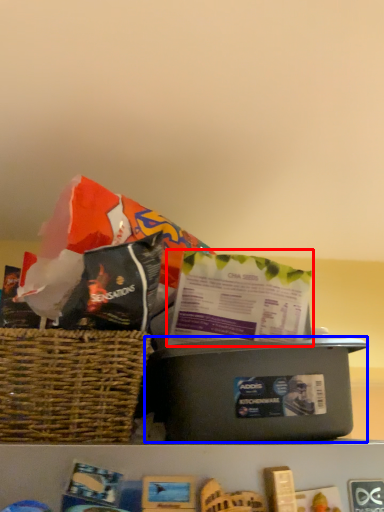
Question: Among these objects, which one is farthest to the camera, gift bag (highlighted by a red box) or box (highlighted by a blue box)?

Choices:
 (A) gift bag
 (B) box

Answer: (A)